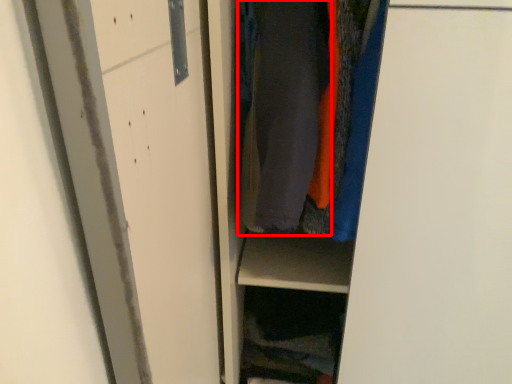
Question: In this image, where is garment (annotated by the red box) located relative to cabinet?

Choices:
 (A) right
 (B) left

Answer: (A)